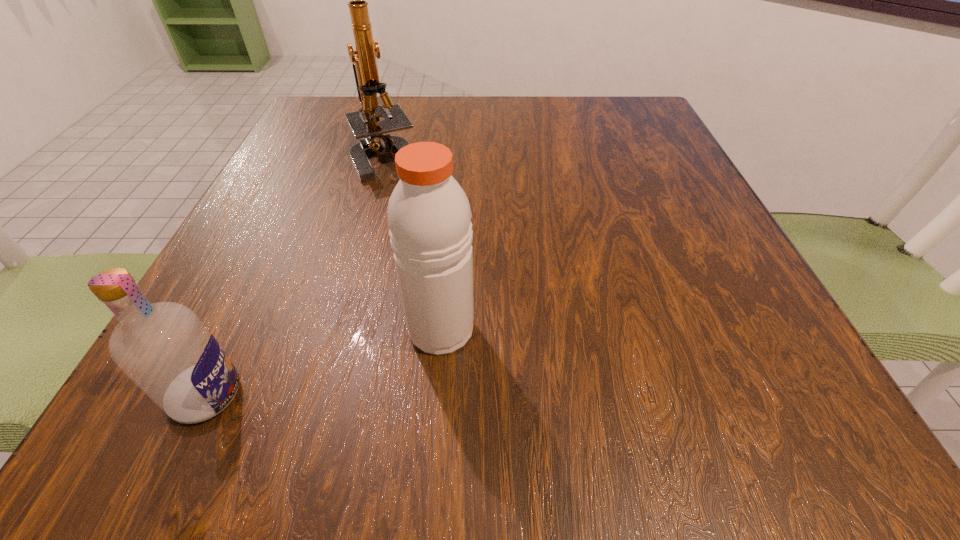
Where is `object located in the near edge section of the desktop`? object located in the near edge section of the desktop is located at coordinates (163, 347).

I want to click on microscope that is positioned at the left edge, so click(x=365, y=123).

The height and width of the screenshot is (540, 960). In order to click on vodka that is positioned at the left edge in this screenshot , I will do `click(163, 347)`.

Find the location of a particular element. object present at the far left corner is located at coordinates (365, 123).

Locate an element on the screen. The height and width of the screenshot is (540, 960). object situated at the near left corner is located at coordinates (163, 347).

This screenshot has height=540, width=960. I want to click on vacant region at the far edge, so click(481, 100).

This screenshot has width=960, height=540. I want to click on free space at the near edge of the desktop, so pos(432,428).

Locate an element on the screen. This screenshot has width=960, height=540. vacant region at the left edge is located at coordinates (259, 299).

Identify the location of vacant space at the right edge of the desktop. (680, 169).

In the image, there is a desktop. In order to click on vacant space at the far left corner in this screenshot , I will do `click(340, 96)`.